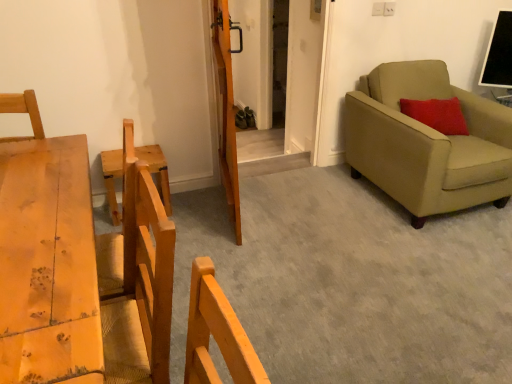
Image resolution: width=512 pixels, height=384 pixels. I want to click on vacant space situated on the left part of wooden door at center, so click(197, 205).